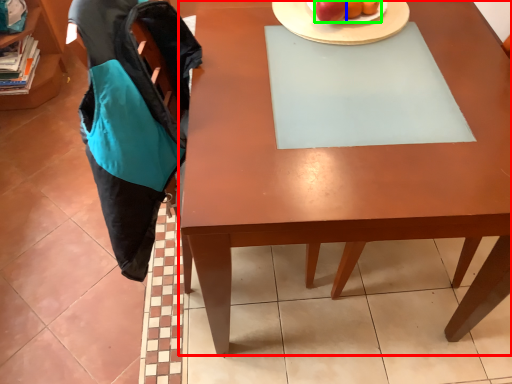
Question: Which is farther away from desk (highlighted by a red box)? apple (highlighted by a blue box) or fruit (highlighted by a green box)?

Choices:
 (A) apple
 (B) fruit

Answer: (A)